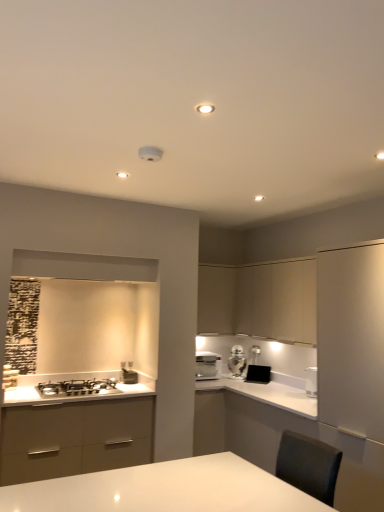
What do you see at coordinates (216, 298) in the screenshot? The height and width of the screenshot is (512, 384). I see `matte beige cabinet at upper center, which is counted as the 2th cabinetry, starting from the right` at bounding box center [216, 298].

At what (x,y) coordinates should I click in order to perform the action: click on matte beige cabinet at upper right, the 1th cabinetry positioned from the right. Please return your answer as a coordinate pair (x, y). Looking at the image, I should click on (259, 301).

What is the approximate width of metallic silver toaster at lower center, which is counted as the second appliance, starting from the back?

The width of metallic silver toaster at lower center, which is counted as the second appliance, starting from the back, is 5.72 inches.

What is the approximate height of white glossy toaster at upper center?

The height of white glossy toaster at upper center is 14.36 inches.

Find the location of a particular element. This screenshot has height=512, width=384. black matte toaster at center, the 1th appliance when ordered from right to left is located at coordinates (258, 374).

Measure the distance from satin silver gas stove at lower left to white glossy toaster at upper center.

The distance of satin silver gas stove at lower left from white glossy toaster at upper center is 5.01 feet.

Can you confirm if satin silver gas stove at lower left is wider than white glossy toaster at upper center?

Yes, satin silver gas stove at lower left is wider than white glossy toaster at upper center.

Does point (65, 395) appear closer or farther from the camera than point (237, 362)?

Point (65, 395).

Is satin silver gas stove at lower left far from white glossy toaster at upper center?

That's right, there is a large distance between satin silver gas stove at lower left and white glossy toaster at upper center.

Based on the photo, is white glossy toaster at upper center positioned in front of matte beige cabinet at upper center, which is counted as the 2th cabinetry, starting from the right?

No.

From the image's perspective, is white glossy toaster at upper center positioned above or below matte beige cabinet at upper center, which is counted as the 2th cabinetry, starting from the right?

From the image's perspective, white glossy toaster at upper center appears below matte beige cabinet at upper center, which is counted as the 2th cabinetry, starting from the right.

Is matte beige cabinet at upper center, the first cabinetry from the left, surrounded by white glossy toaster at upper center?

No, matte beige cabinet at upper center, the first cabinetry from the left, is located outside of white glossy toaster at upper center.

Is white glossy toaster at upper center positioned with its back to matte beige cabinet at upper center, the first cabinetry from the left?

No, white glossy toaster at upper center is not facing away from matte beige cabinet at upper center, the first cabinetry from the left.

Between matte beige cabinet at upper right, which ranks as the 2th cabinetry in left-to-right order, and white glossy coffee machine at center, which one has more height?

With more height is matte beige cabinet at upper right, which ranks as the 2th cabinetry in left-to-right order.

Measure the distance between matte beige cabinet at upper right, the 1th cabinetry positioned from the right, and white glossy coffee machine at center.

matte beige cabinet at upper right, the 1th cabinetry positioned from the right, is 30.23 inches away from white glossy coffee machine at center.

Would you say matte beige cabinet at upper right, which ranks as the 2th cabinetry in left-to-right order, is inside or outside white glossy coffee machine at center?

matte beige cabinet at upper right, which ranks as the 2th cabinetry in left-to-right order, is not inside white glossy coffee machine at center, it's outside.

Could you tell me if white glossy coffee machine at center is turned towards matte beige cabinet at upper right, the 1th cabinetry positioned from the right?

No, white glossy coffee machine at center is not facing towards matte beige cabinet at upper right, the 1th cabinetry positioned from the right.

Is white glossy coffee machine at center directly adjacent to matte beige cabinet at upper right, the 1th cabinetry positioned from the right?

No, white glossy coffee machine at center is not touching matte beige cabinet at upper right, the 1th cabinetry positioned from the right.

From the white glossy coffee machine at center, count 2nd cabinetry to the right and point to it. Please provide its 2D coordinates.

[(259, 301)]

Can you confirm if white glossy coffee machine at center is positioned to the right of matte beige cabinet at upper right, the 1th cabinetry positioned from the right?

Incorrect, white glossy coffee machine at center is not on the right side of matte beige cabinet at upper right, the 1th cabinetry positioned from the right.

Can you tell me how much matte beige cabinet at upper right, the 1th cabinetry positioned from the right, and black matte toaster at center, the 2th appliance when ordered from front to back, differ in facing direction?

There is a 39.5-degree angle between the facing directions of matte beige cabinet at upper right, the 1th cabinetry positioned from the right, and black matte toaster at center, the 2th appliance when ordered from front to back.

Which is more to the right, matte beige cabinet at upper right, which ranks as the 2th cabinetry in left-to-right order, or black matte toaster at center, the 1th appliance in the back-to-front sequence?

From the viewer's perspective, matte beige cabinet at upper right, which ranks as the 2th cabinetry in left-to-right order, appears more on the right side.

In terms of size, does matte beige cabinet at upper right, which ranks as the 2th cabinetry in left-to-right order, appear bigger or smaller than black matte toaster at center, the 1th appliance when ordered from right to left?

matte beige cabinet at upper right, which ranks as the 2th cabinetry in left-to-right order, is bigger than black matte toaster at center, the 1th appliance when ordered from right to left.

Do you think matte beige cabinet at upper right, which ranks as the 2th cabinetry in left-to-right order, is within black matte toaster at center, the 2th appliance when ordered from front to back, or outside of it?

matte beige cabinet at upper right, which ranks as the 2th cabinetry in left-to-right order, is outside black matte toaster at center, the 2th appliance when ordered from front to back.

Looking at this image, is matte beige cabinet at upper center, the first cabinetry from the left, far from white glossy coffee machine at center?

matte beige cabinet at upper center, the first cabinetry from the left, is actually quite close to white glossy coffee machine at center.

Is matte beige cabinet at upper center, which is counted as the 2th cabinetry, starting from the right, positioned before white glossy coffee machine at center?

No, the depth of matte beige cabinet at upper center, which is counted as the 2th cabinetry, starting from the right, is greater than that of white glossy coffee machine at center.

Which is less distant, (203, 271) or (198, 364)?

Point (203, 271) appears to be farther away from the viewer than point (198, 364).

Is metallic silver toaster at lower center, arranged as the 1th appliance when viewed from the front, further to the viewer compared to matte beige cabinet at upper center, which is counted as the 2th cabinetry, starting from the right?

No.

Between point (123, 377) and point (221, 316), which one is positioned behind?

The point (221, 316) is farther from the camera.

Which object is positioned more to the right, metallic silver toaster at lower center, which is counted as the second appliance, starting from the back, or matte beige cabinet at upper center, the first cabinetry from the left?

matte beige cabinet at upper center, the first cabinetry from the left.

Is metallic silver toaster at lower center, the second appliance positioned from the right, situated inside matte beige cabinet at upper center, the first cabinetry from the left, or outside?

metallic silver toaster at lower center, the second appliance positioned from the right, is spatially situated outside matte beige cabinet at upper center, the first cabinetry from the left.

I want to click on gas stove below the white glossy toaster at upper center (from a real-world perspective), so click(77, 388).

This screenshot has height=512, width=384. Identify the location of the 2nd cabinetry located above the white glossy toaster at upper center (from a real-world perspective). (216, 298).

From the image, which object appears to be nearer to white glossy coffee machine at center, white glossy toaster at upper center or black matte toaster at center, the 1th appliance when ordered from right to left?

white glossy toaster at upper center is positioned closer to the anchor white glossy coffee machine at center.

Considering their positions, is matte beige cabinet at upper right, the 1th cabinetry positioned from the right, positioned further to satin silver gas stove at lower left than white glossy countertop at center?

matte beige cabinet at upper right, the 1th cabinetry positioned from the right, lies further to satin silver gas stove at lower left than the other object.

When comparing their distances from matte beige cabinet at upper center, which is counted as the 2th cabinetry, starting from the right, does white glossy countertop at center or satin silver gas stove at lower left seem further?

satin silver gas stove at lower left is positioned further to the anchor matte beige cabinet at upper center, which is counted as the 2th cabinetry, starting from the right.

From the image, which object appears to be farther from white glossy coffee machine at center, matte beige cabinet at upper right, which ranks as the 2th cabinetry in left-to-right order, or white glossy toaster at upper center?

matte beige cabinet at upper right, which ranks as the 2th cabinetry in left-to-right order, is positioned further to the anchor white glossy coffee machine at center.

Which object lies nearer to the anchor point black matte toaster at center, the 1th appliance when ordered from right to left, white glossy toaster at upper center or matte beige cabinet at upper right, which ranks as the 2th cabinetry in left-to-right order?

The object closer to black matte toaster at center, the 1th appliance when ordered from right to left, is white glossy toaster at upper center.

Looking at the image, which one is located closer to white glossy toaster at upper center, metallic silver toaster at lower center, which is counted as the second appliance, starting from the back, or black matte toaster at center, the 2th appliance when ordered from front to back?

black matte toaster at center, the 2th appliance when ordered from front to back.

From the image, which object appears to be farther from white glossy toaster at upper center, white glossy countertop at center or matte beige cabinet at upper right, which ranks as the 2th cabinetry in left-to-right order?

matte beige cabinet at upper right, which ranks as the 2th cabinetry in left-to-right order, lies further to white glossy toaster at upper center than the other object.

From the picture: Which object lies nearer to the anchor point matte beige cabinet at upper center, which is counted as the 2th cabinetry, starting from the right, black matte toaster at center, the 1th appliance when ordered from right to left, or metallic silver toaster at lower center, the second appliance positioned from the right?

black matte toaster at center, the 1th appliance when ordered from right to left, lies closer to matte beige cabinet at upper center, which is counted as the 2th cabinetry, starting from the right, than the other object.

Identify the location of gas stove located between white glossy countertop at center and black matte toaster at center, the 1th appliance when ordered from right to left, in the depth direction. (77, 388).

The image size is (384, 512). In order to click on home appliance situated between satin silver gas stove at lower left and matte beige cabinet at upper center, which is counted as the 2th cabinetry, starting from the right, from left to right in this screenshot , I will do `click(208, 366)`.

The width and height of the screenshot is (384, 512). What are the coordinates of `home appliance between metallic silver toaster at lower center, the second appliance positioned from the right, and white glossy toaster at upper center` in the screenshot? It's located at point(208,366).

You are a GUI agent. You are given a task and a screenshot of the screen. Output one action in this format:
    pyautogui.click(x=<x>, y=<y>)
    Task: Click on the appliance located between satin silver gas stove at lower left and black matte toaster at center, the 2th appliance when ordered from front to back, in the left-right direction
    The image size is (384, 512).
    Given the screenshot: What is the action you would take?
    pos(129,376)